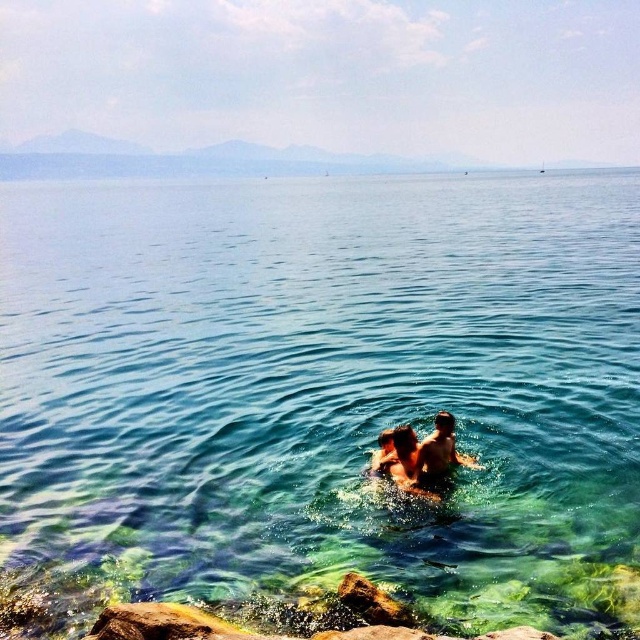
Which is below, clear water at center or smooth skin couple at center?

smooth skin couple at center is below.

Describe the element at coordinates (324, 388) in the screenshot. The width and height of the screenshot is (640, 640). I see `clear water at center` at that location.

Between point (189, 182) and point (390, 465), which one is positioned in front?

Point (390, 465)

The width and height of the screenshot is (640, 640). I want to click on clear water at center, so click(x=324, y=388).

Between smooth skin couple at center and smooth skin man at center, which one has less height?

With less height is smooth skin man at center.

What do you see at coordinates (420, 456) in the screenshot? I see `smooth skin couple at center` at bounding box center [420, 456].

What are the coordinates of `smooth skin couple at center` in the screenshot? It's located at (420, 456).

Where is `smooth skin couple at center`? This screenshot has height=640, width=640. smooth skin couple at center is located at coordinates (420, 456).

In the scene shown: Is the position of clear water at center less distant than that of smooth skin man at center?

That is True.

Based on the photo, can you confirm if clear water at center is positioned above smooth skin man at center?

Yes.

This screenshot has height=640, width=640. What do you see at coordinates (324, 388) in the screenshot?
I see `clear water at center` at bounding box center [324, 388].

Find the location of a particular element. clear water at center is located at coordinates (324, 388).